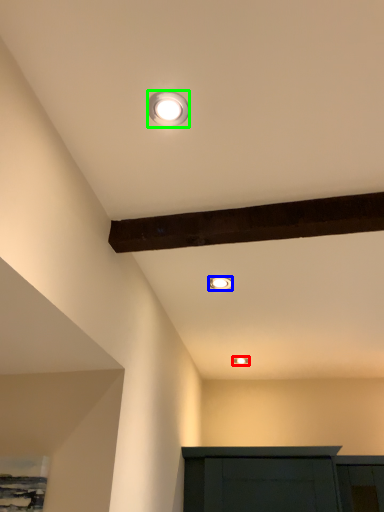
Question: Estimate the real-world distances between objects in this image. Which object is farther from lamp (highlighted by a red box), lamp (highlighted by a blue box) or lamp (highlighted by a green box)?

Choices:
 (A) lamp
 (B) lamp

Answer: (B)